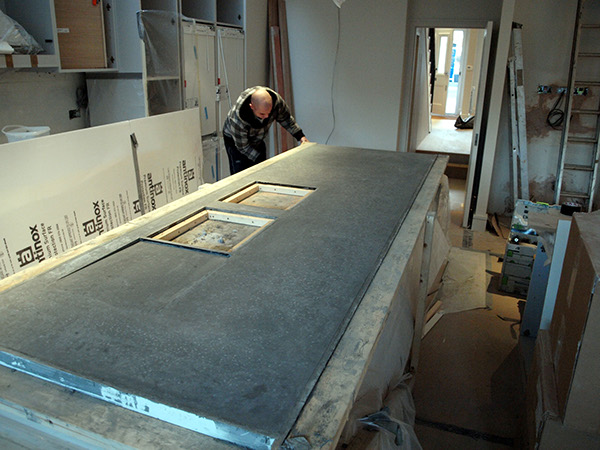
Identify the location of open cabinets / cubbies. This screenshot has width=600, height=450. (220, 15), (196, 3), (165, 10).